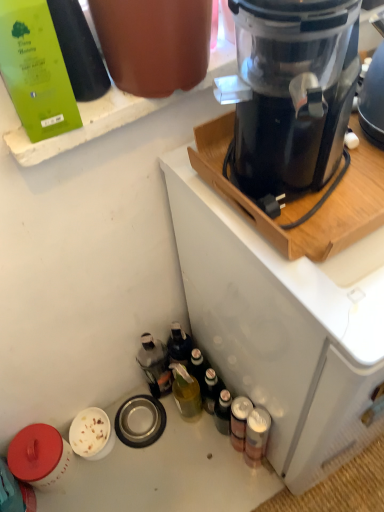
Question: Considering the positions of translucent plastic bottle at lower left, arranged as the 2th bottle when viewed from the right, and black plastic blender at upper right in the image, is translucent plastic bottle at lower left, arranged as the 2th bottle when viewed from the right, wider or thinner than black plastic blender at upper right?

Choices:
 (A) thin
 (B) wide

Answer: (A)

Question: Which is correct: translucent plastic bottle at lower left, the second bottle viewed from the left, is inside black plastic blender at upper right, or outside of it?

Choices:
 (A) outside
 (B) inside

Answer: (A)

Question: Which object is positioned farthest from the black plastic coffee maker at upper right?

Choices:
 (A) metallic silver can at lower right, positioned as the 1th bottle in right-to-left order
 (B) black plastic blender at upper right
 (C) translucent plastic bottle at lower left, the 2th bottle from the top
 (D) green matte bottle at upper left, the third bottle from the right

Answer: (D)

Question: Which object is positioned closest to the black plastic coffee maker at upper right?

Choices:
 (A) black plastic blender at upper right
 (B) green matte bottle at upper left, the first bottle from the front
 (C) metallic silver can at lower right, the 1th bottle in the bottom-to-top sequence
 (D) translucent plastic bottle at lower left, arranged as the 2th bottle when viewed from the right

Answer: (A)